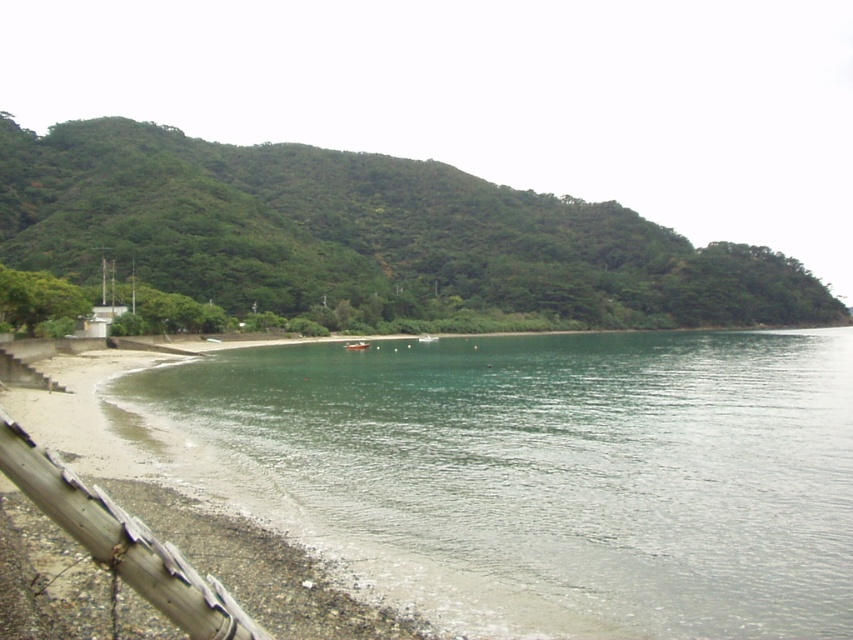
Image resolution: width=853 pixels, height=640 pixels. What do you see at coordinates (543, 472) in the screenshot? I see `clear water at lower left` at bounding box center [543, 472].

The width and height of the screenshot is (853, 640). In order to click on clear water at lower left in this screenshot , I will do `click(543, 472)`.

Between green leafy hillside at upper left and rusty metal rail at lower left, which one is positioned lower?

rusty metal rail at lower left is below.

Is green leafy hillside at upper left taller than rusty metal rail at lower left?

Indeed, green leafy hillside at upper left has a greater height compared to rusty metal rail at lower left.

At what (x,y) coordinates should I click in order to perform the action: click on green leafy hillside at upper left. Please return your answer as a coordinate pair (x, y). This screenshot has height=640, width=853. Looking at the image, I should click on (364, 234).

The image size is (853, 640). I want to click on green leafy hillside at upper left, so click(364, 234).

Does point (704, 472) lie behind point (10, 440)?

Yes, point (704, 472) is farther from viewer.

Can you confirm if clear water at lower left is shorter than rusty metal rail at lower left?

Yes, clear water at lower left is shorter than rusty metal rail at lower left.

Is point (271, 483) farther from viewer compared to point (180, 572)?

Yes, point (271, 483) is farther from viewer.

Where is `clear water at lower left`? The height and width of the screenshot is (640, 853). clear water at lower left is located at coordinates (543, 472).